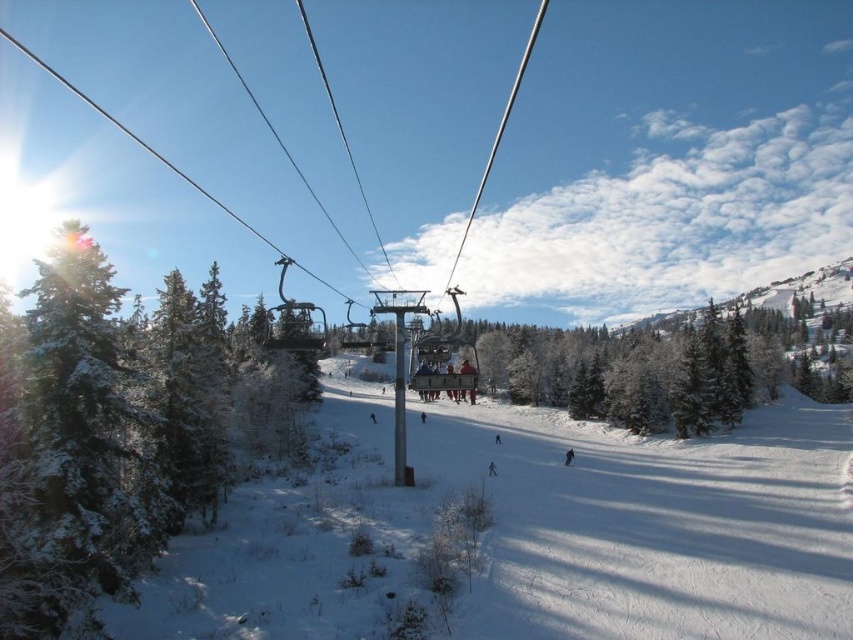
Who is more forward, (109, 384) or (495, 474)?

Point (109, 384) is more forward.

Does snow-covered evergreen at left have a greater width compared to white snowboarder at center?

Yes.

Which is in front, point (67, 285) or point (492, 468)?

Positioned in front is point (67, 285).

Locate an element on the screen. This screenshot has width=853, height=640. snow-covered evergreen at left is located at coordinates (113, 433).

Who is more distant from viewer, (566, 465) or (491, 467)?

Point (566, 465)

Who is higher up, black snowboarder at lower center or white snowboarder at center?

white snowboarder at center is above.

Image resolution: width=853 pixels, height=640 pixels. Find the location of `black snowboarder at lower center`. black snowboarder at lower center is located at coordinates (567, 456).

Where is `black snowboarder at lower center`? This screenshot has width=853, height=640. black snowboarder at lower center is located at coordinates (567, 456).

Which is more to the right, snow-covered evergreen at left or black snowboarder at lower center?

From the viewer's perspective, black snowboarder at lower center appears more on the right side.

Who is more distant from viewer, [68,362] or [572,449]?

The point [572,449] is behind.

I want to click on snow-covered evergreen at left, so click(113, 433).